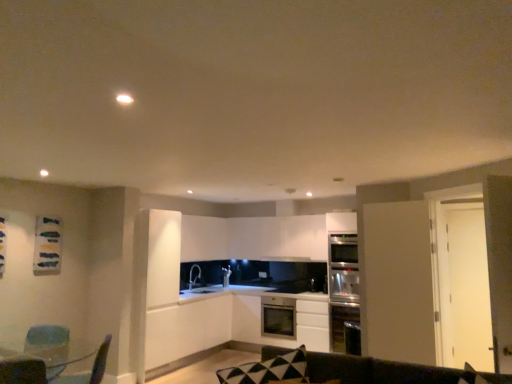
At what (x,y) coordinates should I click in order to perform the action: click on white matte cabinet at center, which is the second cabinetry from bottom to top. Please return your answer as a coordinate pair (x, y). The width and height of the screenshot is (512, 384). Looking at the image, I should click on (187, 328).

What is the approximate height of matte glass table at lower left?

matte glass table at lower left is 18.53 inches tall.

Find the location of a particular element. satin silver oven at right is located at coordinates (342, 287).

Locate an element on the screen. The image size is (512, 384). metallic blue swivel chair at lower left, which is the first swivel chair in right-to-left order is located at coordinates (91, 370).

The width and height of the screenshot is (512, 384). Identify the location of stainless steel oven at center, which is the first cabinetry in bottom-to-top order. (303, 320).

How much space does white matte cabinet at center, which is counted as the first cabinetry, starting from the top, occupy vertically?

white matte cabinet at center, which is counted as the first cabinetry, starting from the top, is 29.09 inches in height.

Where is `green fabric swivel chair at lower left, arranged as the 2th swivel chair when viewed from the right`? The width and height of the screenshot is (512, 384). green fabric swivel chair at lower left, arranged as the 2th swivel chair when viewed from the right is located at coordinates (47, 335).

From the picture: Could you tell me if white matte cabinet at center, the third cabinetry when ordered from bottom to top, is facing satin silver oven at right?

Yes, white matte cabinet at center, the third cabinetry when ordered from bottom to top, is facing satin silver oven at right.

Is white matte cabinet at center, the third cabinetry when ordered from bottom to top, next to satin silver oven at right and touching it?

There is a gap between white matte cabinet at center, the third cabinetry when ordered from bottom to top, and satin silver oven at right.

From a real-world perspective, between white matte cabinet at center, the third cabinetry when ordered from bottom to top, and satin silver oven at right, who is vertically higher?

From a 3D spatial view, white matte cabinet at center, the third cabinetry when ordered from bottom to top, is above.

Is white matte cabinet at center, which is counted as the first cabinetry, starting from the top, positioned beyond the bounds of satin silver oven at right?

That's correct, white matte cabinet at center, which is counted as the first cabinetry, starting from the top, is outside of satin silver oven at right.

Can you tell me how much white matte cabinet at center, placed as the second cabinetry when sorted from top to bottom, and satin silver oven at right differ in facing direction?

90 degrees.

Find the location of a particular element. The width and height of the screenshot is (512, 384). the 1st cabinetry located beneath the satin silver oven at right (from a real-world perspective) is located at coordinates (187, 328).

Is the depth of white matte cabinet at center, which is the second cabinetry from bottom to top, greater than that of satin silver oven at right?

No.

From a real-world perspective, is white matte cabinet at center, which is the second cabinetry from bottom to top, physically below satin silver oven at right?

Yes.

Consider the image. Which is in front, satin silver oven at right or white matte cabinet at center, which is the second cabinetry from bottom to top?

white matte cabinet at center, which is the second cabinetry from bottom to top.

From a real-world perspective, which is physically below, satin silver oven at right or white matte cabinet at center, placed as the second cabinetry when sorted from top to bottom?

white matte cabinet at center, placed as the second cabinetry when sorted from top to bottom, from a real-world perspective.

Which is more to the left, satin silver oven at right or white matte cabinet at center, which is the second cabinetry from bottom to top?

From the viewer's perspective, white matte cabinet at center, which is the second cabinetry from bottom to top, appears more on the left side.

Is satin silver oven at right situated inside white matte cabinet at center, which is the second cabinetry from bottom to top, or outside?

satin silver oven at right lies outside white matte cabinet at center, which is the second cabinetry from bottom to top.

Which object is wider, white matte cabinet at center, which is the second cabinetry from bottom to top, or satin stainless steel dishwasher at center?

Wider between the two is white matte cabinet at center, which is the second cabinetry from bottom to top.

Does white matte cabinet at center, which is the second cabinetry from bottom to top, have a larger size compared to satin stainless steel dishwasher at center?

Indeed, white matte cabinet at center, which is the second cabinetry from bottom to top, has a larger size compared to satin stainless steel dishwasher at center.

Considering the positions of objects white matte cabinet at center, placed as the second cabinetry when sorted from top to bottom, and satin stainless steel dishwasher at center in the image provided, who is more to the right, white matte cabinet at center, placed as the second cabinetry when sorted from top to bottom, or satin stainless steel dishwasher at center?

Positioned to the right is satin stainless steel dishwasher at center.

Who is shorter, white matte cabinet at center, placed as the second cabinetry when sorted from top to bottom, or satin stainless steel dishwasher at center?

satin stainless steel dishwasher at center.

From the image's perspective, which one is positioned higher, green fabric swivel chair at lower left, arranged as the 2th swivel chair when viewed from the right, or dark brown leather couch at lower center?

dark brown leather couch at lower center is shown above in the image.

In the image, is green fabric swivel chair at lower left, the first swivel chair in the left-to-right sequence, positioned in front of or behind dark brown leather couch at lower center?

Visually, green fabric swivel chair at lower left, the first swivel chair in the left-to-right sequence, is located behind dark brown leather couch at lower center.

Based on the photo, can you tell me how much green fabric swivel chair at lower left, the first swivel chair in the left-to-right sequence, and dark brown leather couch at lower center differ in facing direction?

The angular difference between green fabric swivel chair at lower left, the first swivel chair in the left-to-right sequence, and dark brown leather couch at lower center is 35.8 degrees.

Could dark brown leather couch at lower center be considered to be inside green fabric swivel chair at lower left, the first swivel chair in the left-to-right sequence?

No.

Is point (346, 317) closer or farther from the camera than point (104, 346)?

Point (346, 317) is farther from the camera than point (104, 346).

Measure the distance between satin silver oven at right and metallic blue swivel chair at lower left, which is the first swivel chair in right-to-left order.

satin silver oven at right and metallic blue swivel chair at lower left, which is the first swivel chair in right-to-left order, are 3.79 meters apart.

From the image's perspective, between satin silver oven at right and metallic blue swivel chair at lower left, the second swivel chair when ordered from left to right, which one is located above?

satin silver oven at right appears higher in the image.

Considering the sizes of objects satin silver oven at right and metallic blue swivel chair at lower left, which is the first swivel chair in right-to-left order, in the image provided, who is taller, satin silver oven at right or metallic blue swivel chair at lower left, which is the first swivel chair in right-to-left order,?

With more height is satin silver oven at right.

Considering the relative sizes of stainless steel oven at center, which is the first cabinetry in bottom-to-top order, and white matte cabinet at center, placed as the second cabinetry when sorted from top to bottom, in the image provided, is stainless steel oven at center, which is the first cabinetry in bottom-to-top order, bigger than white matte cabinet at center, placed as the second cabinetry when sorted from top to bottom,?

No, stainless steel oven at center, which is the first cabinetry in bottom-to-top order, is not bigger than white matte cabinet at center, placed as the second cabinetry when sorted from top to bottom.

Is stainless steel oven at center, which is the first cabinetry in bottom-to-top order, positioned beyond the bounds of white matte cabinet at center, which is the second cabinetry from bottom to top?

stainless steel oven at center, which is the first cabinetry in bottom-to-top order, is positioned outside white matte cabinet at center, which is the second cabinetry from bottom to top.

Is there a large distance between stainless steel oven at center, which is the first cabinetry in bottom-to-top order, and white matte cabinet at center, which is the second cabinetry from bottom to top?

stainless steel oven at center, which is the first cabinetry in bottom-to-top order, is positioned a significant distance from white matte cabinet at center, which is the second cabinetry from bottom to top.

Is stainless steel oven at center, the 3th cabinetry viewed from the top, oriented away from white matte cabinet at center, which is the second cabinetry from bottom to top?

stainless steel oven at center, the 3th cabinetry viewed from the top, is not turned away from white matte cabinet at center, which is the second cabinetry from bottom to top.

I want to click on cabinetry that is above the satin silver oven at right (from a real-world perspective), so click(x=204, y=238).

Locate an element on the screen. The width and height of the screenshot is (512, 384). oven on the right side of white matte cabinet at center, which is the second cabinetry from bottom to top is located at coordinates (342, 287).

From the picture: Which object lies nearer to the anchor point metallic blue swivel chair at lower left, the second swivel chair when ordered from left to right, stainless steel oven at center, which is the first cabinetry in bottom-to-top order, or dark brown leather couch at lower center?

The object closer to metallic blue swivel chair at lower left, the second swivel chair when ordered from left to right, is dark brown leather couch at lower center.

When comparing their distances from metallic blue swivel chair at lower left, the second swivel chair when ordered from left to right, does green fabric swivel chair at lower left, the first swivel chair in the left-to-right sequence, or stainless steel oven at center, the 3th cabinetry viewed from the top, seem further?

The object further to metallic blue swivel chair at lower left, the second swivel chair when ordered from left to right, is stainless steel oven at center, the 3th cabinetry viewed from the top.

Looking at the image, which one is located closer to white matte cabinet at center, which is counted as the first cabinetry, starting from the top, metallic blue swivel chair at lower left, which is the first swivel chair in right-to-left order, or matte glass table at lower left?

Among the two, metallic blue swivel chair at lower left, which is the first swivel chair in right-to-left order, is located nearer to white matte cabinet at center, which is counted as the first cabinetry, starting from the top.

Based on their spatial positions, is white matte cabinet at center, which is the second cabinetry from bottom to top, or stainless steel oven at center, which is the first cabinetry in bottom-to-top order, closer to green fabric swivel chair at lower left, arranged as the 2th swivel chair when viewed from the right?

white matte cabinet at center, which is the second cabinetry from bottom to top, is positioned closer to the anchor green fabric swivel chair at lower left, arranged as the 2th swivel chair when viewed from the right.

From the image, which object appears to be farther from satin stainless steel dishwasher at center, stainless steel oven at center, the 3th cabinetry viewed from the top, or matte glass table at lower left?

matte glass table at lower left.

When comparing their distances from stainless steel oven at center, which is the first cabinetry in bottom-to-top order, does metallic blue swivel chair at lower left, the second swivel chair when ordered from left to right, or white matte cabinet at center, placed as the second cabinetry when sorted from top to bottom, seem closer?

Based on the image, white matte cabinet at center, placed as the second cabinetry when sorted from top to bottom, appears to be nearer to stainless steel oven at center, which is the first cabinetry in bottom-to-top order.

Estimate the real-world distances between objects in this image. Which object is further from white matte cabinet at center, which is the second cabinetry from bottom to top, white matte cabinet at center, the third cabinetry when ordered from bottom to top, or satin stainless steel dishwasher at center?

Among the two, satin stainless steel dishwasher at center is located further to white matte cabinet at center, which is the second cabinetry from bottom to top.

From the image, which object appears to be nearer to satin stainless steel dishwasher at center, green fabric swivel chair at lower left, the first swivel chair in the left-to-right sequence, or dark brown leather couch at lower center?

green fabric swivel chair at lower left, the first swivel chair in the left-to-right sequence.

The height and width of the screenshot is (384, 512). I want to click on dish washer between matte glass table at lower left and satin silver oven at right in the horizontal direction, so click(278, 317).

Locate an element on the screen. This screenshot has height=384, width=512. oven between dark brown leather couch at lower center and stainless steel oven at center, which is the first cabinetry in bottom-to-top order, from front to back is located at coordinates (342, 287).

Find the location of a particular element. The image size is (512, 384). dish washer between dark brown leather couch at lower center and white matte cabinet at center, which is counted as the first cabinetry, starting from the top, from front to back is located at coordinates pyautogui.click(x=278, y=317).

The image size is (512, 384). In order to click on dish washer between white matte cabinet at center, the third cabinetry when ordered from bottom to top, and stainless steel oven at center, the 3th cabinetry viewed from the top, in the horizontal direction in this screenshot , I will do `click(278, 317)`.